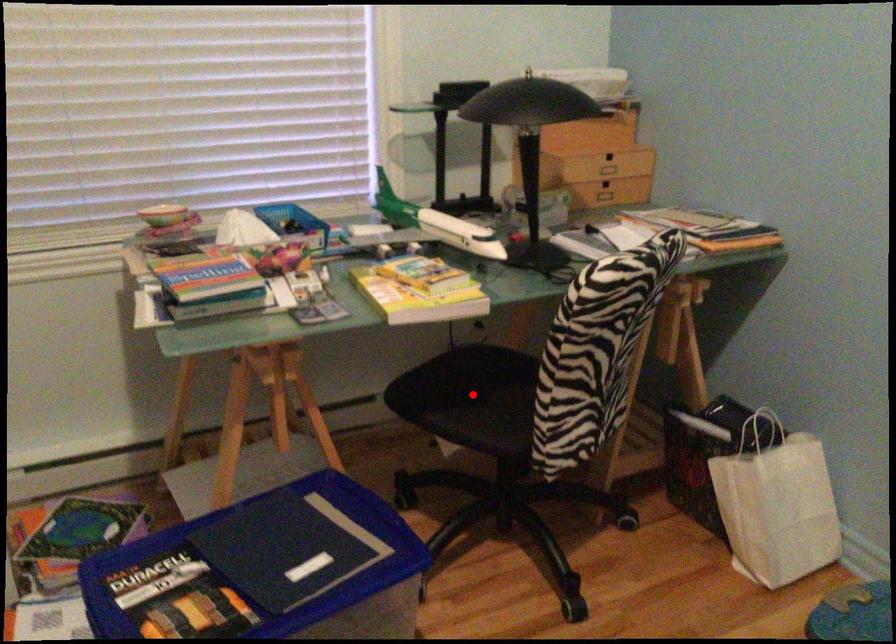
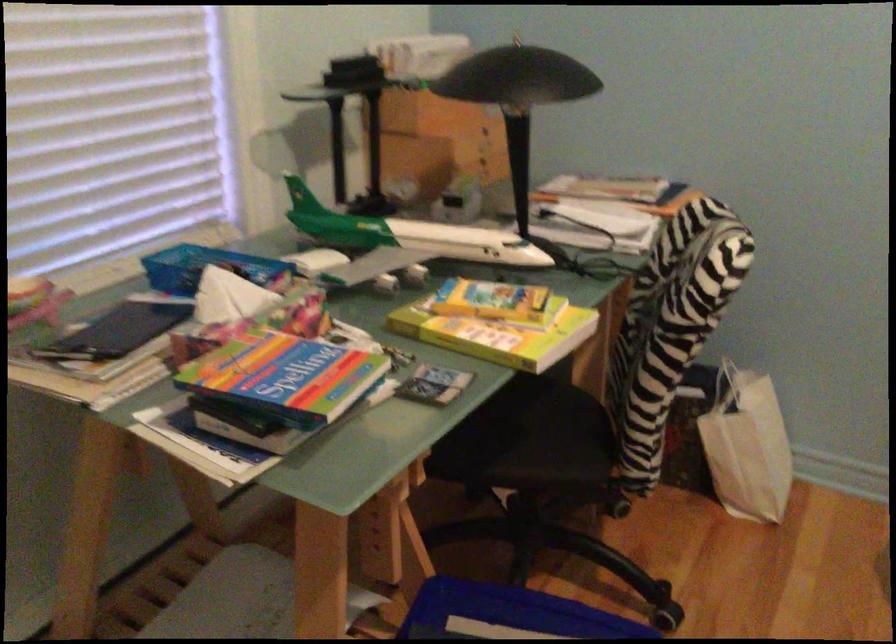
In the second image, find the point that corresponds to the highlighted location in the first image.

(510, 430)